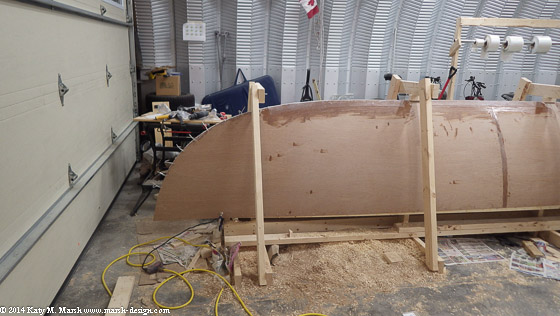
Where is `white wall`? white wall is located at coordinates (352, 54).